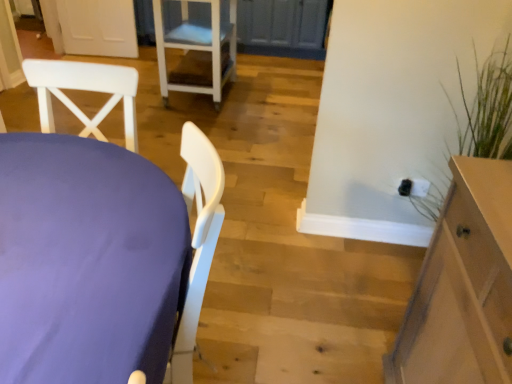
Question: Does white plastic chair at upper center have a lesser width compared to light brown wood cabinet at right?

Choices:
 (A) yes
 (B) no

Answer: (B)

Question: Is white plastic chair at upper center not within light brown wood cabinet at right?

Choices:
 (A) no
 (B) yes

Answer: (B)

Question: Is the depth of white plastic chair at upper center less than that of light brown wood cabinet at right?

Choices:
 (A) no
 (B) yes

Answer: (A)

Question: Is white plastic chair at upper center far away from light brown wood cabinet at right?

Choices:
 (A) no
 (B) yes

Answer: (B)

Question: Considering the relative positions of white plastic chair at upper center and light brown wood cabinet at right in the image provided, is white plastic chair at upper center to the right of light brown wood cabinet at right from the viewer's perspective?

Choices:
 (A) no
 (B) yes

Answer: (A)

Question: Is white plastic chair at upper center taller than light brown wood cabinet at right?

Choices:
 (A) yes
 (B) no

Answer: (B)

Question: Is white plastic chair at upper center behind purple fabric table at left?

Choices:
 (A) no
 (B) yes

Answer: (B)

Question: Is white plastic chair at upper center smaller than purple fabric table at left?

Choices:
 (A) yes
 (B) no

Answer: (B)

Question: Considering the relative sizes of white plastic chair at upper center and purple fabric table at left in the image provided, is white plastic chair at upper center bigger than purple fabric table at left?

Choices:
 (A) no
 (B) yes

Answer: (B)

Question: Does white plastic chair at upper center turn towards purple fabric table at left?

Choices:
 (A) no
 (B) yes

Answer: (A)

Question: Can you confirm if white plastic chair at upper center is wider than purple fabric table at left?

Choices:
 (A) yes
 (B) no

Answer: (A)

Question: Considering the relative sizes of white plastic chair at upper center and purple fabric table at left in the image provided, is white plastic chair at upper center taller than purple fabric table at left?

Choices:
 (A) yes
 (B) no

Answer: (B)

Question: Can you confirm if purple fabric table at left is positioned to the right of white plastic chair at upper center?

Choices:
 (A) no
 (B) yes

Answer: (B)